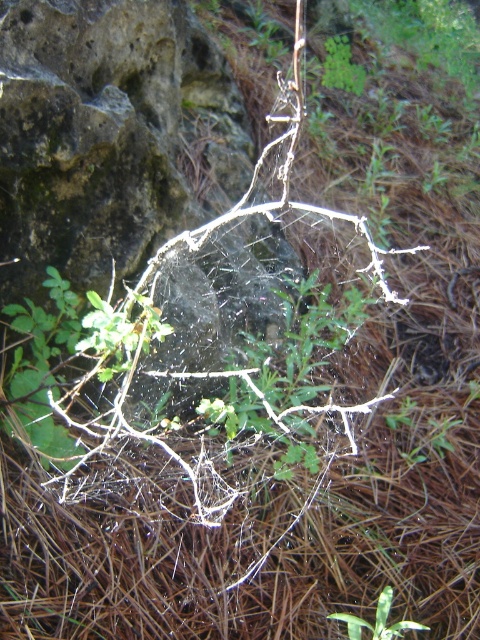
Is green leafy plant at upper center taller than green leafy plant at center?

Yes, green leafy plant at upper center is taller than green leafy plant at center.

Where is `green leafy plant at upper center`? green leafy plant at upper center is located at coordinates (342, 67).

Where is `green leafy plant at upper center`? green leafy plant at upper center is located at coordinates (342, 67).